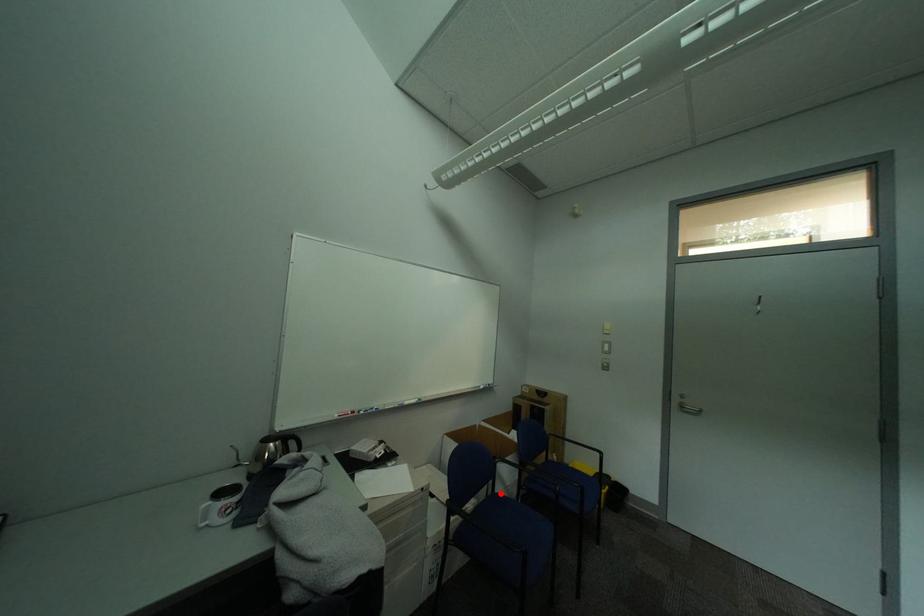
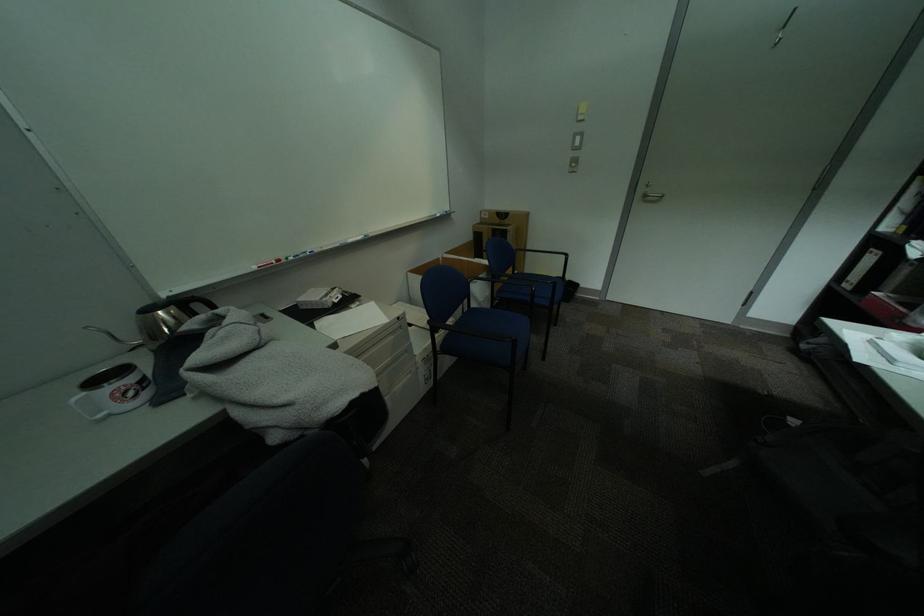
In the second image, find the point that corresponds to the highlighted location in the first image.

(477, 310)